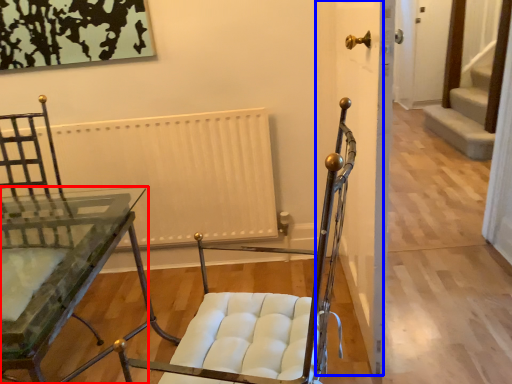
Question: Which object appears closest to the camera in this image, table (highlighted by a red box) or door (highlighted by a blue box)?

Choices:
 (A) table
 (B) door

Answer: (A)